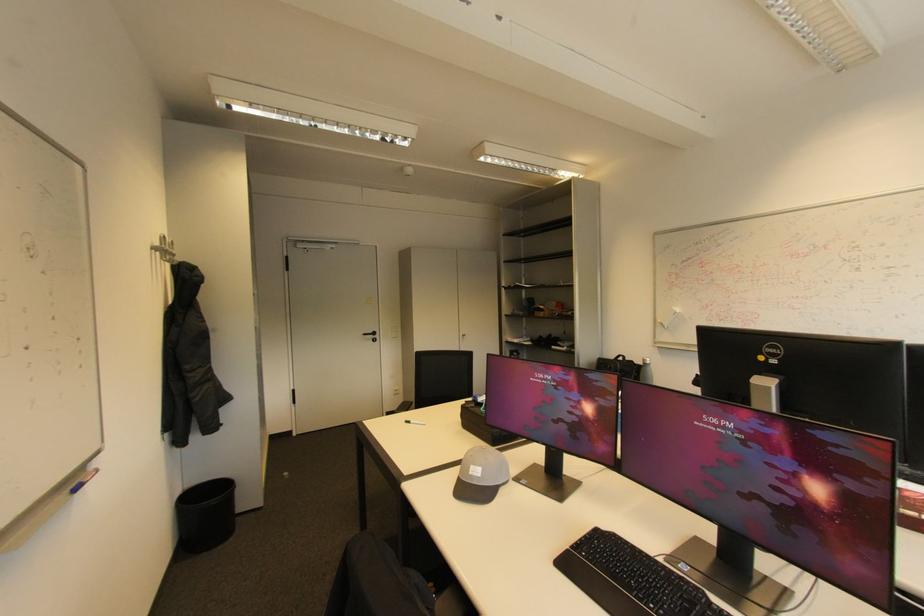
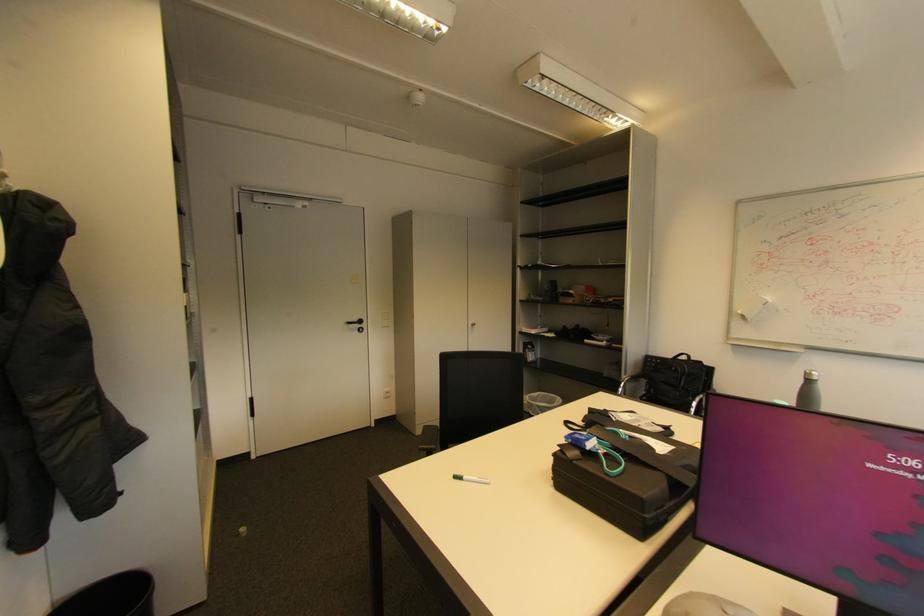
Locate, in the second image, the point that corresponds to [287,477] in the first image.

(244, 535)